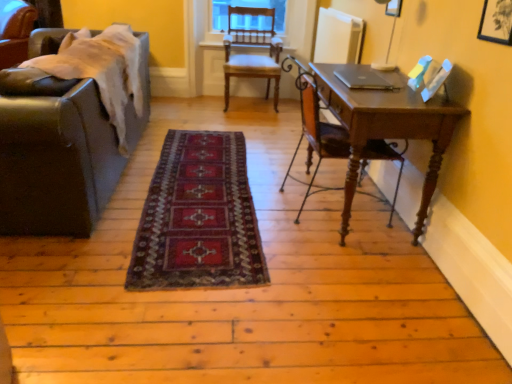
Question: Considering the positions of point (361, 134) and point (140, 56), is point (361, 134) closer or farther from the camera than point (140, 56)?

Choices:
 (A) closer
 (B) farther

Answer: (A)

Question: Would you say wooden desk at right is inside or outside leather couch at left?

Choices:
 (A) inside
 (B) outside

Answer: (B)

Question: Estimate the real-world distances between objects in this image. Which object is farther from the leather couch at left, which is counted as the 3th chair, starting from the front?

Choices:
 (A) leather couch at left
 (B) dark red woven rug at center
 (C) wooden chair at center, which appears as the 2th chair when viewed from the front
 (D) sleek silver laptop at center
 (E) wooden desk at right

Answer: (D)

Question: Which is nearer to the leather couch at left?

Choices:
 (A) wooden chair at center, which appears as the 2th chair when viewed from the front
 (B) leather couch at left, which appears as the first chair when viewed from the back
 (C) sleek silver laptop at center
 (D) wooden chair at right, marked as the 1th chair in a right-to-left arrangement
 (E) wooden desk at right

Answer: (D)